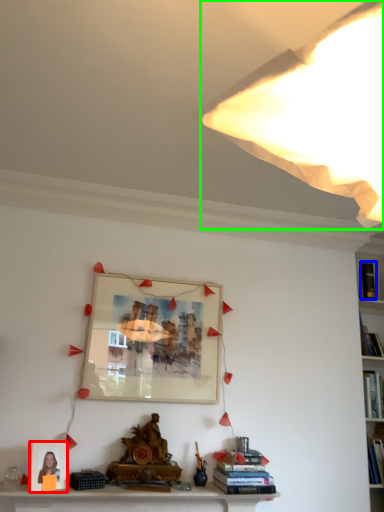
Question: Based on their relative distances, which object is farther from picture frame (highlighted by a red box)? Choose from book (highlighted by a blue box) and light (highlighted by a green box).

Choices:
 (A) book
 (B) light

Answer: (A)